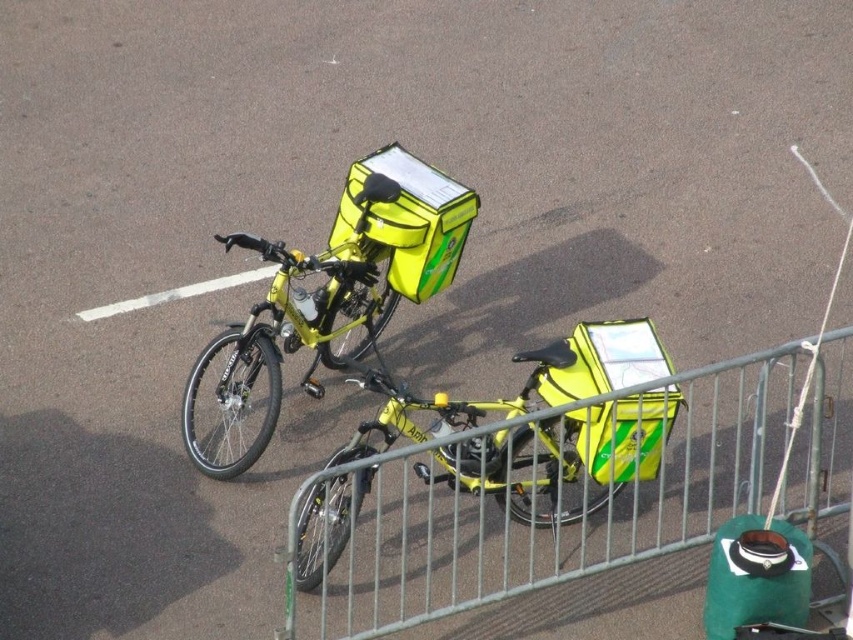
You are standing in front of the two delivery bicycles. You notice two points marked on the image. Point A is at coordinates point (506, 429) and Point B is at point (186, 412). Which point is closer to you?

Point A at point (506, 429) is closer to you than point B at point (186, 412).